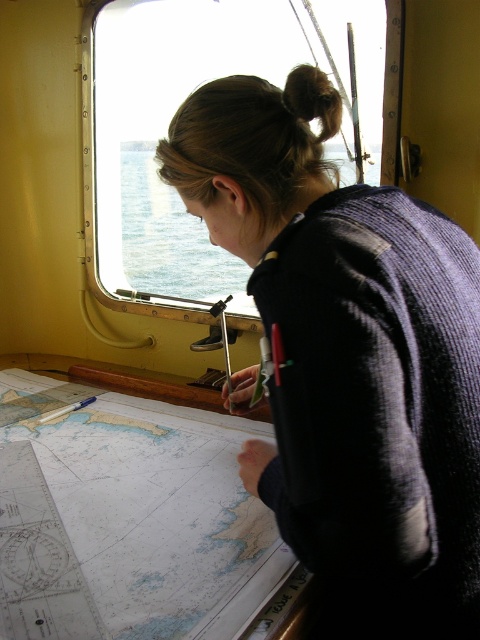
Is point (465, 428) farther from camera compared to point (122, 589)?

No, it is not.

Who is lower down, dark blue sweater at center or white paper map at lower left?

white paper map at lower left is lower down.

Locate an element on the screen. dark blue sweater at center is located at coordinates (349, 364).

The image size is (480, 640). What are the coordinates of `dark blue sweater at center` in the screenshot? It's located at (349, 364).

Does point (43, 621) lie behind point (296, 74)?

No, it is not.

Does white paper map at lower left have a greater height compared to brown hair at upper center?

Yes, white paper map at lower left is taller than brown hair at upper center.

What are the coordinates of `white paper map at lower left` in the screenshot? It's located at (127, 520).

Is white paper map at lower left above clear glass window at upper center?

No.

This screenshot has width=480, height=640. What do you see at coordinates (127, 520) in the screenshot? I see `white paper map at lower left` at bounding box center [127, 520].

Between point (69, 580) and point (121, 230), which one is positioned behind?

Point (121, 230)

Where is `white paper map at lower left`? Image resolution: width=480 pixels, height=640 pixels. white paper map at lower left is located at coordinates (127, 520).